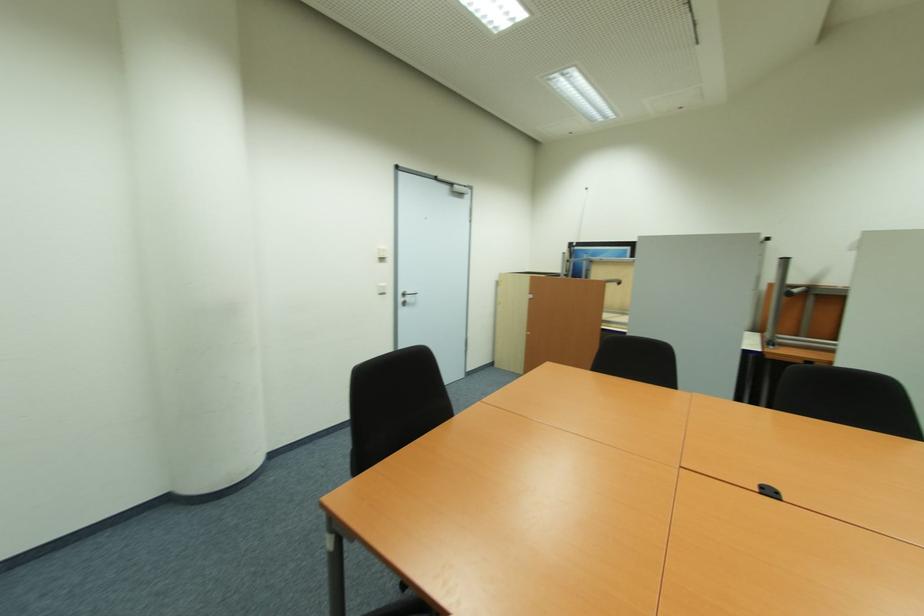
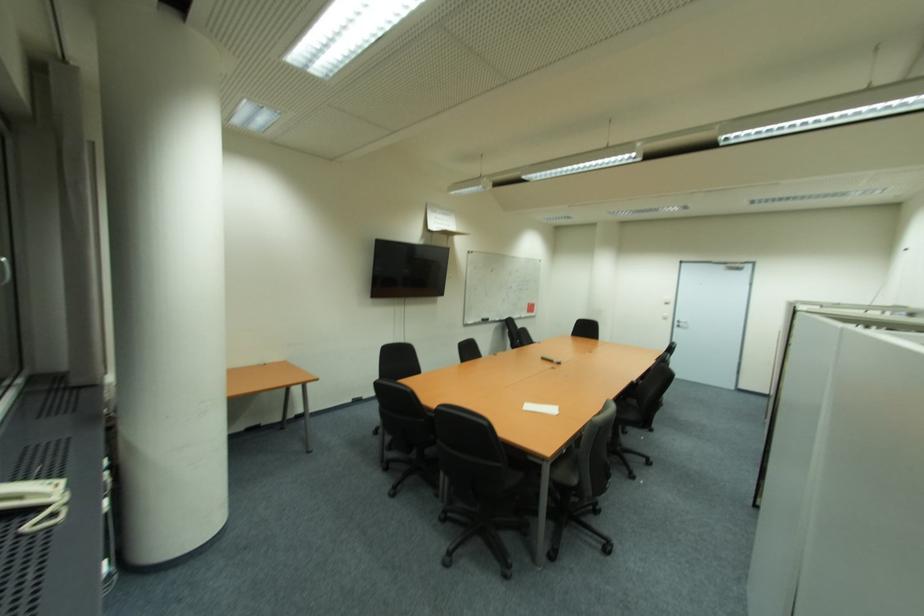
Locate, in the second image, the point that corresponds to [410,300] in the first image.

(686, 325)